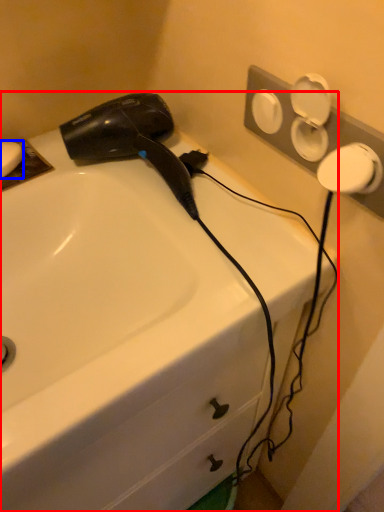
Question: Among these objects, which one is nearest to the camera, sink (highlighted by a red box) or soap (highlighted by a blue box)?

Choices:
 (A) sink
 (B) soap

Answer: (A)